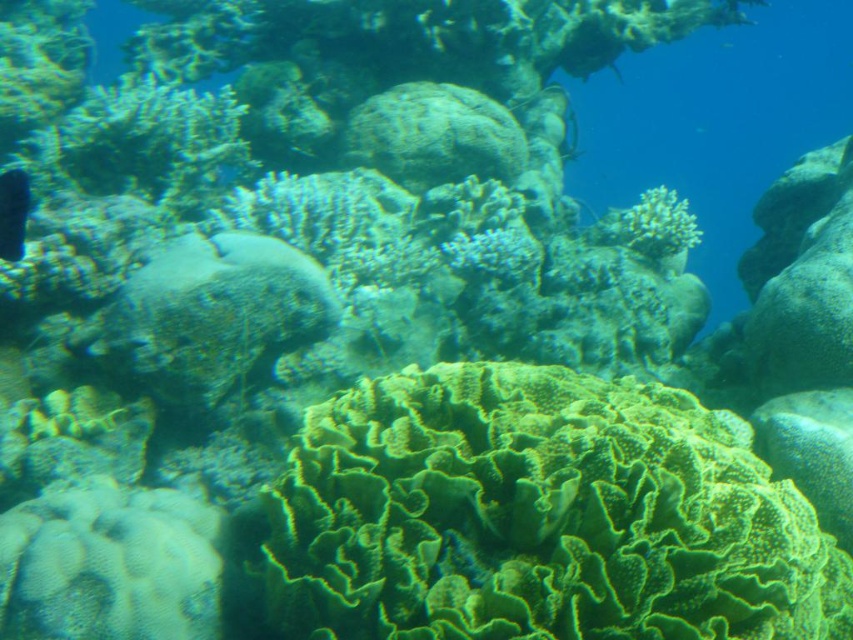
Question: Does green textured coral at center have a larger size compared to shiny black fish at left?

Choices:
 (A) yes
 (B) no

Answer: (A)

Question: Which object appears closest to the camera in this image?

Choices:
 (A) green textured coral at center
 (B) shiny black fish at left

Answer: (A)

Question: Can you confirm if green textured coral at center is positioned to the right of shiny black fish at left?

Choices:
 (A) yes
 (B) no

Answer: (A)

Question: Does green textured coral at center come behind shiny black fish at left?

Choices:
 (A) yes
 (B) no

Answer: (B)